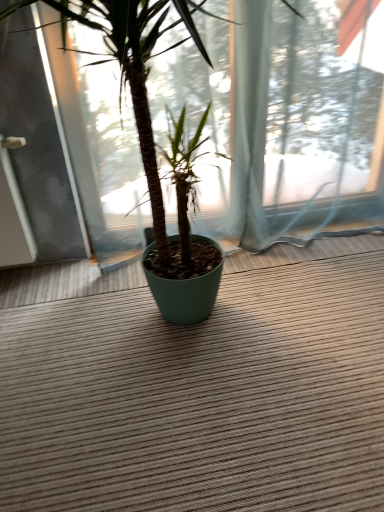
Question: From the image's perspective, is brown textured doormat at center positioned above or below green textured pot at center?

Choices:
 (A) above
 (B) below

Answer: (B)

Question: Is brown textured doormat at center in front of or behind green textured pot at center in the image?

Choices:
 (A) front
 (B) behind

Answer: (B)

Question: In the image, is brown textured doormat at center on the left side or the right side of green textured pot at center?

Choices:
 (A) right
 (B) left

Answer: (A)

Question: Looking at their shapes, would you say green textured pot at center is wider or thinner than brown textured doormat at center?

Choices:
 (A) thin
 (B) wide

Answer: (A)

Question: From a real-world perspective, is green textured pot at center positioned above or below brown textured doormat at center?

Choices:
 (A) below
 (B) above

Answer: (B)

Question: In terms of height, does green textured pot at center look taller or shorter compared to brown textured doormat at center?

Choices:
 (A) tall
 (B) short

Answer: (A)

Question: From the image's perspective, is green textured pot at center positioned above or below brown textured doormat at center?

Choices:
 (A) below
 (B) above

Answer: (B)